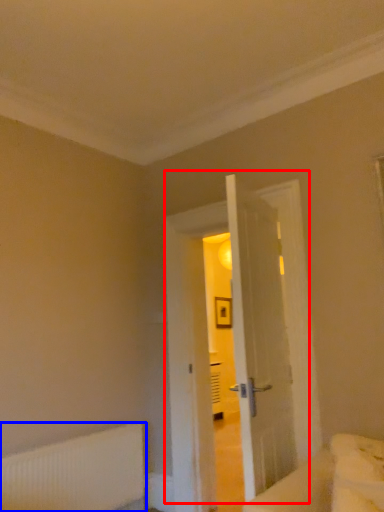
Question: Which of the following is the farthest to the observer, door (highlighted by a red box) or radiator (highlighted by a blue box)?

Choices:
 (A) door
 (B) radiator

Answer: (A)